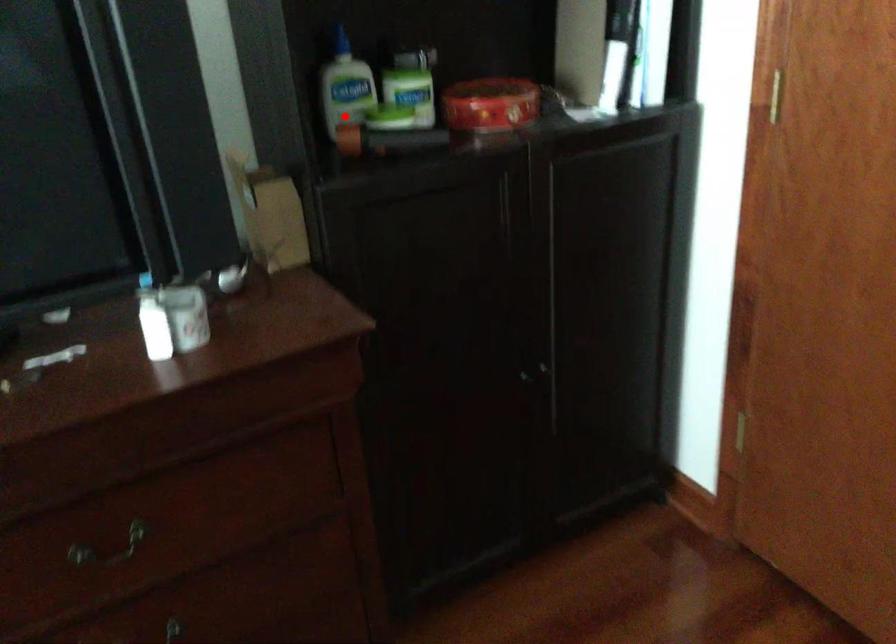
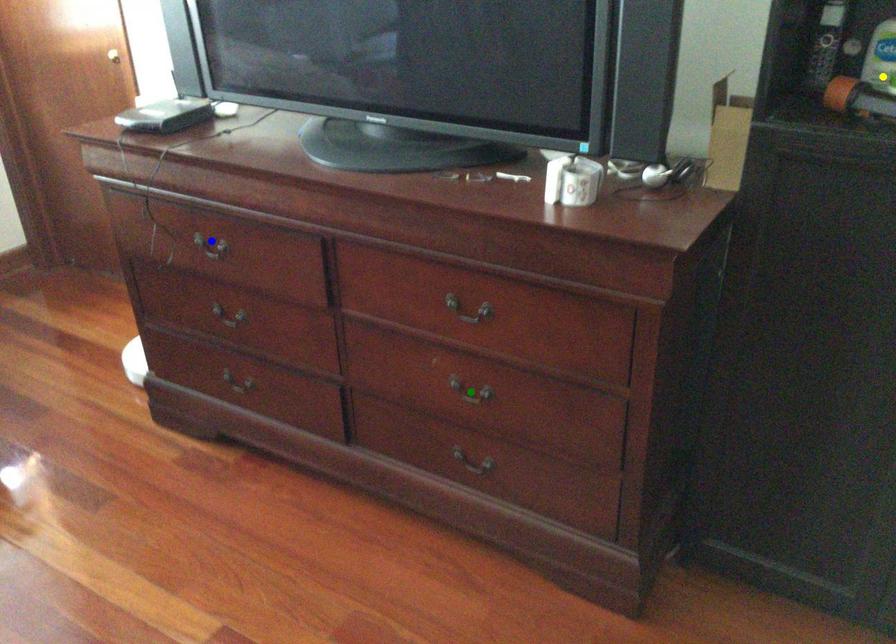
Question: I am providing you with two images of the same scene from different viewpoints. A red point is marked on the first image. You are given multiple points on the second image. In image 2, which mark is for the same physical point as the one in image 1?

Choices:
 (A) blue point
 (B) green point
 (C) yellow point

Answer: (C)